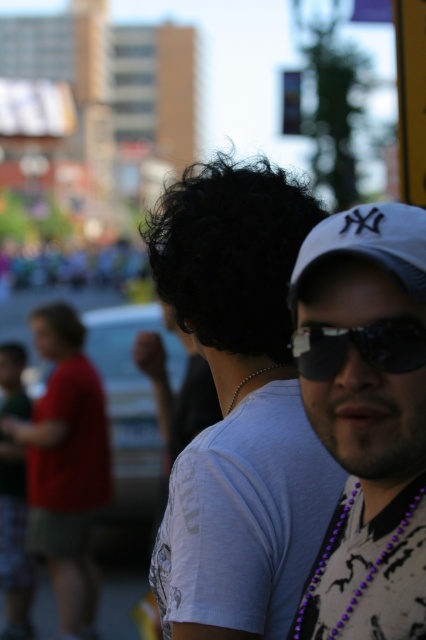
Question: Is white matte cap at upper right bigger than purple beaded necklace at lower right?

Choices:
 (A) no
 (B) yes

Answer: (B)

Question: Which object appears farthest from the camera in this image?

Choices:
 (A) matte red shirt at left
 (B) purple beaded necklace at lower right

Answer: (A)

Question: Is white matte cap at upper right to the right of purple beaded necklace at lower right from the viewer's perspective?

Choices:
 (A) yes
 (B) no

Answer: (B)

Question: Which point is farther from the camera taking this photo?

Choices:
 (A) (423, 524)
 (B) (218, 484)

Answer: (B)

Question: Which object is the closest to the purple beaded necklace at lower right?

Choices:
 (A) white matte baseball cap at right
 (B) pearl necklace at upper center
 (C) white t-shirt at center
 (D) white matte cap at upper right

Answer: (D)

Question: Where is white t-shirt at center located in relation to pearl necklace at upper center in the image?

Choices:
 (A) left
 (B) right

Answer: (A)